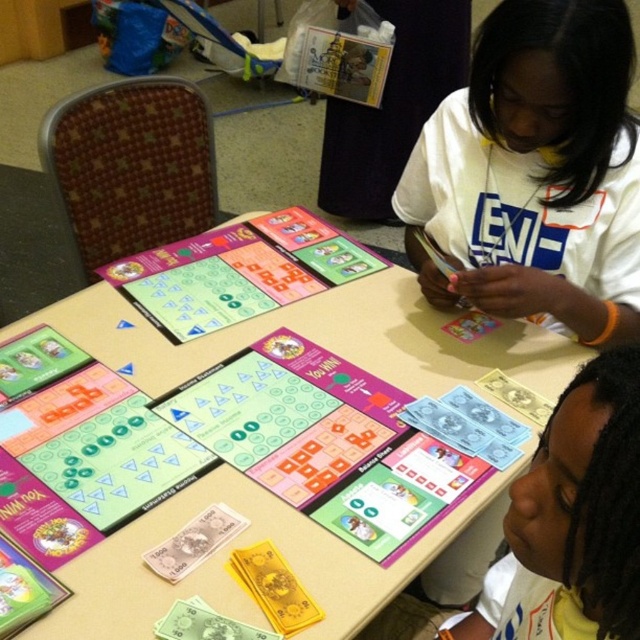
Who is positioned more to the left, cardboard game board at center or white matte shirt at upper right?

cardboard game board at center

Does cardboard game board at center appear on the left side of white matte shirt at upper right?

Yes, cardboard game board at center is to the left of white matte shirt at upper right.

In order to click on cardboard game board at center in this screenshot , I will do `click(250, 428)`.

The width and height of the screenshot is (640, 640). What are the coordinates of `cardboard game board at center` in the screenshot? It's located at (250, 428).